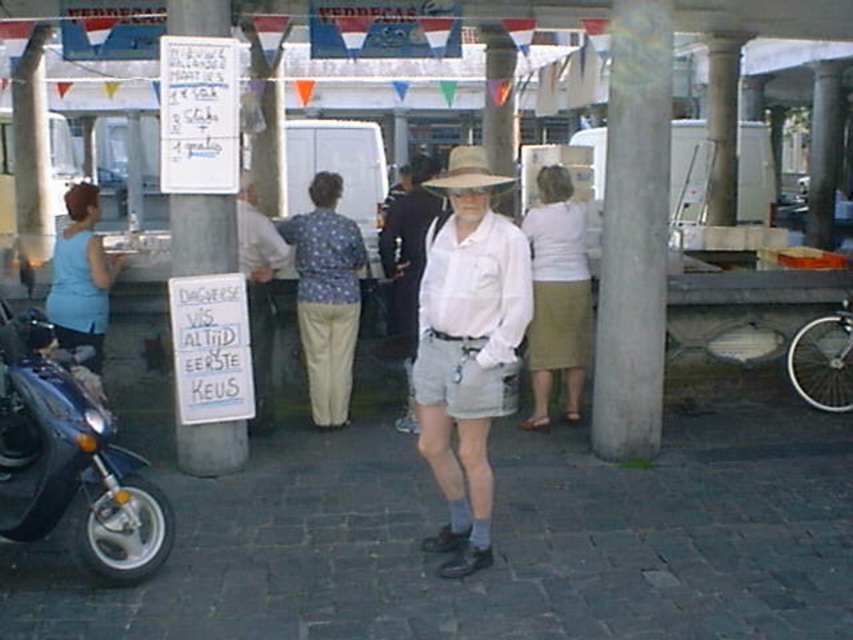
Does point (412, 316) come farther from viewer compared to point (509, 184)?

Yes, point (412, 316) is farther from viewer.

Is point (438, 204) positioned in front of point (447, 179)?

No.

Measure the distance between point (x=436, y=196) and camera.

The distance of point (x=436, y=196) from camera is 16.49 feet.

Find the location of a particular element. Image resolution: width=853 pixels, height=640 pixels. white cotton shirt at center is located at coordinates (407, 262).

Does light blue fabric blouse at left appear over strawmaterial/texturehat at center?

Incorrect, light blue fabric blouse at left is not positioned above strawmaterial/texturehat at center.

Does light blue fabric blouse at left appear on the left side of strawmaterial/texturehat at center?

Correct, you'll find light blue fabric blouse at left to the left of strawmaterial/texturehat at center.

Is point (105, 260) positioned behind point (451, 177)?

Yes, point (105, 260) is behind point (451, 177).

Identify the location of light blue fabric blouse at left. tap(80, 276).

Can you confirm if light beige cotton shorts at center is positioned below strawmaterial/texturehat at center?

Yes, light beige cotton shorts at center is below strawmaterial/texturehat at center.

Who is more distant from viewer, (440, 380) or (508, 177)?

Point (508, 177)

Identify the location of light beige cotton shorts at center. (467, 348).